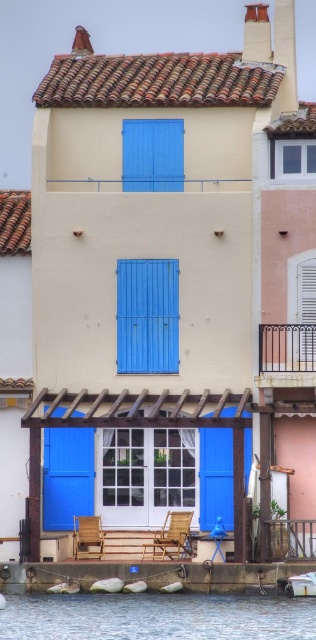
Is clear glass window at upper right thinner than white wood shutter at upper right?

No, clear glass window at upper right is not thinner than white wood shutter at upper right.

Which is behind, point (314, 173) or point (308, 259)?

Point (314, 173)

The image size is (316, 640). Find the location of `clear glass window at upper right`. clear glass window at upper right is located at coordinates (291, 157).

Between point (98, 611) and point (0, 602), which one is positioned behind?

Positioned behind is point (98, 611).

Is clear water at lower center positioned in front of white matte boat at lower left?

That is True.

At what (x,y) coordinates should I click in order to perform the action: click on clear water at lower center. Please return your answer as a coordinate pair (x, y). The width and height of the screenshot is (316, 640). Looking at the image, I should click on (157, 616).

Locate an element on the screen. The height and width of the screenshot is (640, 316). clear water at lower center is located at coordinates (157, 616).

Can you confirm if blue painted wood window at center is wider than clear glass window at upper right?

Yes, blue painted wood window at center is wider than clear glass window at upper right.

Who is taller, blue painted wood window at center or clear glass window at upper right?

Standing taller between the two is blue painted wood window at center.

At what (x,y) coordinates should I click in order to perform the action: click on blue painted wood window at center. Please return your answer as a coordinate pair (x, y). Looking at the image, I should click on (146, 316).